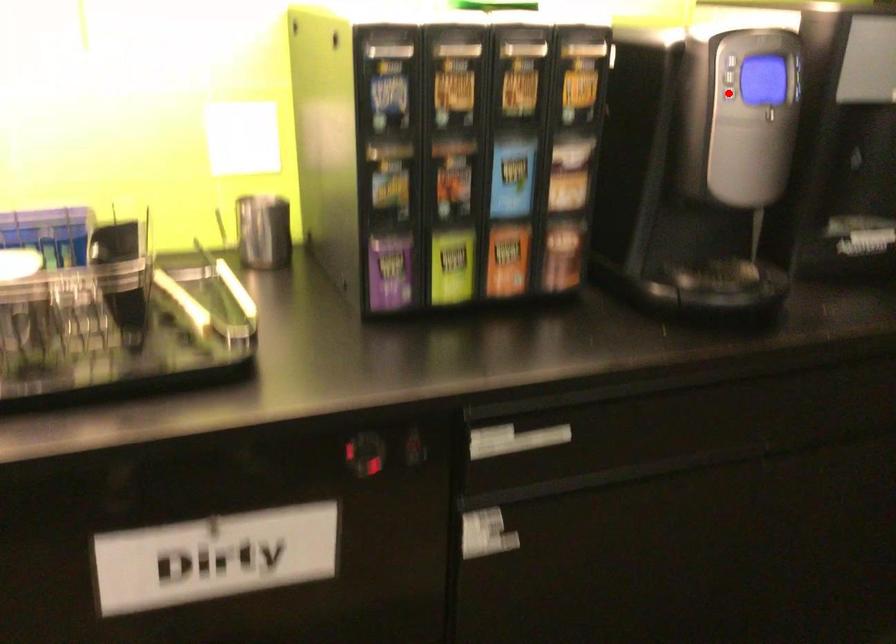
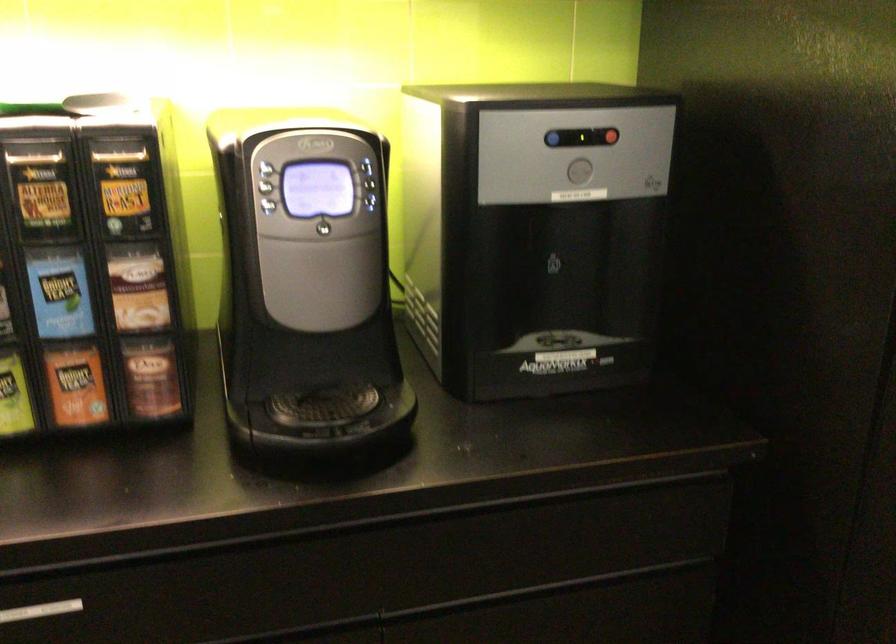
Question: I am providing you with two images of the same scene from different viewpoints. A red point is marked on the first image. Can you still see the location of the red point in image 2?

Choices:
 (A) Yes
 (B) No

Answer: (A)